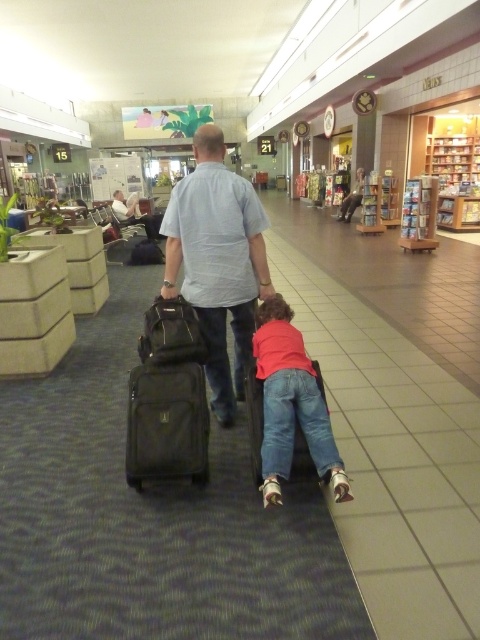
The height and width of the screenshot is (640, 480). What are the coordinates of `matte pink shirt at center` in the screenshot? It's located at 290,404.

Does point (275, 320) come in front of point (169, 461)?

No, (275, 320) is behind (169, 461).

Does point (348, 499) lie in front of point (206, 444)?

Yes, it is in front of point (206, 444).

Where is `matte pink shirt at center`? This screenshot has height=640, width=480. matte pink shirt at center is located at coordinates (290, 404).

Between black fabric suitcase at center and matte black suitcase at center, which one is positioned higher?

Positioned higher is matte black suitcase at center.

In the scene shown: Can you confirm if black fabric suitcase at center is taller than matte black suitcase at center?

Yes.

Measure the distance between point [144,435] and camera.

They are 2.41 meters apart.

This screenshot has width=480, height=640. I want to click on black fabric suitcase at center, so click(167, 422).

Between light blue shirt at center and matte pink shirt at center, which one has more height?

light blue shirt at center is taller.

Can you confirm if light blue shirt at center is thinner than matte pink shirt at center?

In fact, light blue shirt at center might be wider than matte pink shirt at center.

Who is more forward, (x=219, y=282) or (x=280, y=452)?

Point (x=280, y=452)

Where is `light blue shirt at center`? light blue shirt at center is located at coordinates click(217, 260).